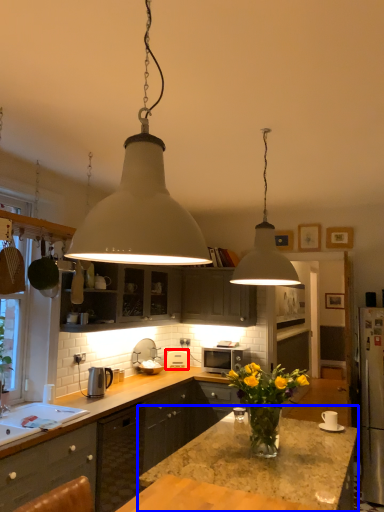
Question: Among these objects, which one is nearest to the camera, appliance (highlighted by a red box) or countertop (highlighted by a blue box)?

Choices:
 (A) appliance
 (B) countertop

Answer: (B)